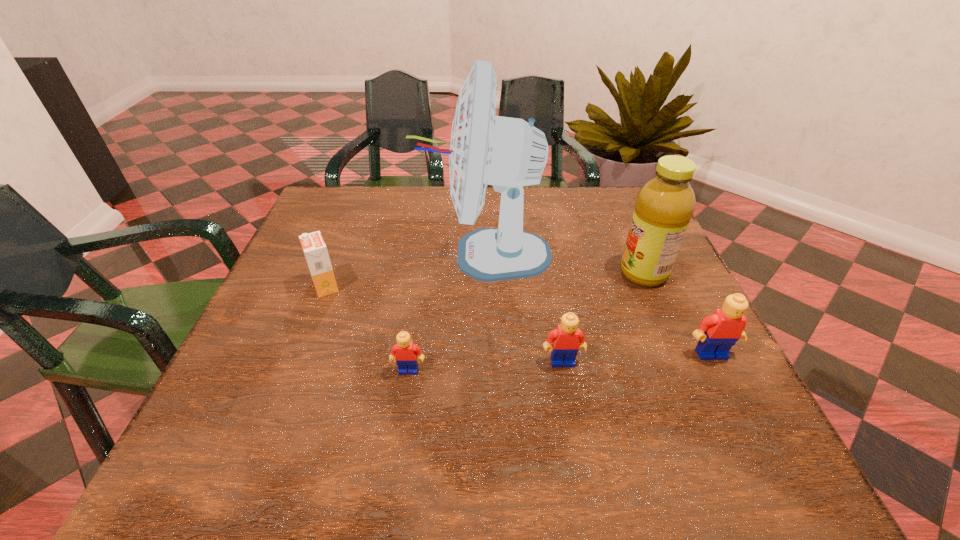
Identify the location of the shortest object. (405, 353).

Locate an element on the screen. the leftmost Lego is located at coordinates (405, 353).

Image resolution: width=960 pixels, height=540 pixels. What are the coordinates of `the second tallest Lego` in the screenshot? It's located at (567, 339).

I want to click on the rightmost Lego, so click(717, 333).

This screenshot has width=960, height=540. In order to click on the tallest object in this screenshot , I will do `click(509, 153)`.

Locate an element on the screen. This screenshot has height=540, width=960. orange juice is located at coordinates [314, 248].

Identify the location of fruit juice. This screenshot has width=960, height=540. (664, 206).

You are a GUI agent. You are given a task and a screenshot of the screen. Output one action in this format:
    pyautogui.click(x=<x>, y=<y>)
    Task: Click on the free space located 0.080m on the face of the shortest Lego
    This screenshot has width=960, height=540.
    Given the screenshot: What is the action you would take?
    pyautogui.click(x=402, y=414)

Identify the location of free location located on the face of the second Lego from right to left. (571, 410).

Identify the location of free spot located on the grille of the tallest object. (317, 254).